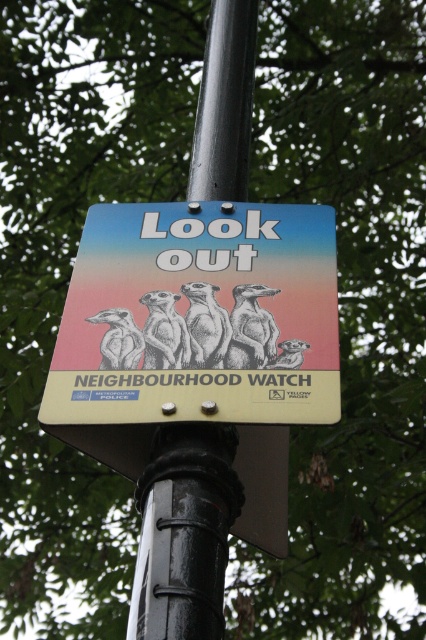
Can you confirm if matte plastic sign at center is positioned below black metal pole at center?

Correct, matte plastic sign at center is located below black metal pole at center.

Locate an element on the screen. matte plastic sign at center is located at coordinates (198, 316).

In order to click on matte plastic sign at center in this screenshot , I will do `click(198, 316)`.